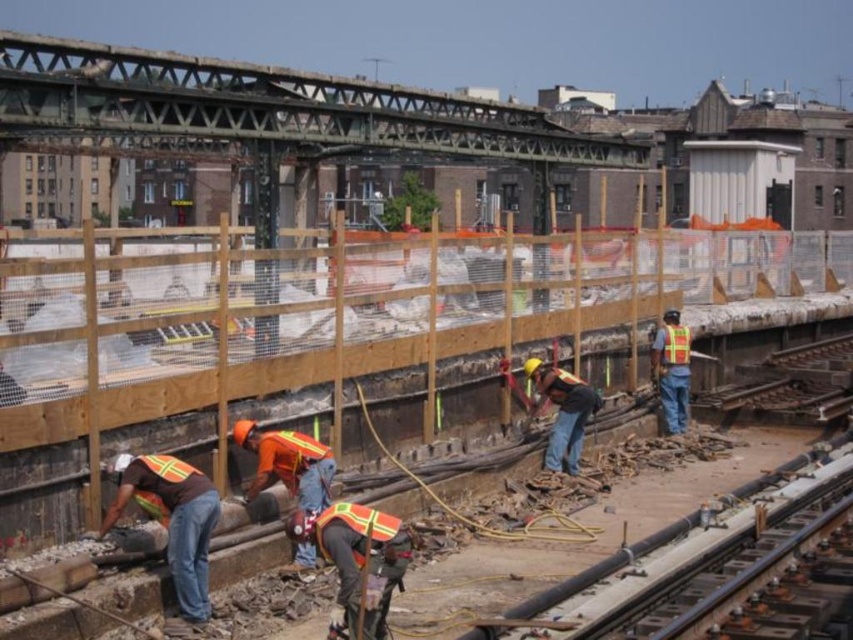
Question: Does brown reflective vest at lower left appear over reflective yellow safety vest at center?

Choices:
 (A) yes
 (B) no

Answer: (B)

Question: Can you confirm if reflective orange vest at center is positioned below reflective yellow safety vest at center?

Choices:
 (A) no
 (B) yes

Answer: (B)

Question: Which object appears closest to the camera in this image?

Choices:
 (A) brown reflective vest at lower left
 (B) reflective yellow safety vest at center

Answer: (A)

Question: Among these objects, which one is nearest to the camera?

Choices:
 (A) reflective orange vest at center
 (B) brown reflective vest at lower left

Answer: (B)

Question: Which is farther from the reflective orange vest at center?

Choices:
 (A) reflective yellow safety vest at center
 (B) brown reflective vest at lower left

Answer: (B)

Question: Considering the relative positions of brown reflective vest at lower left and reflective orange vest at center in the image provided, where is brown reflective vest at lower left located with respect to reflective orange vest at center?

Choices:
 (A) above
 (B) below

Answer: (B)